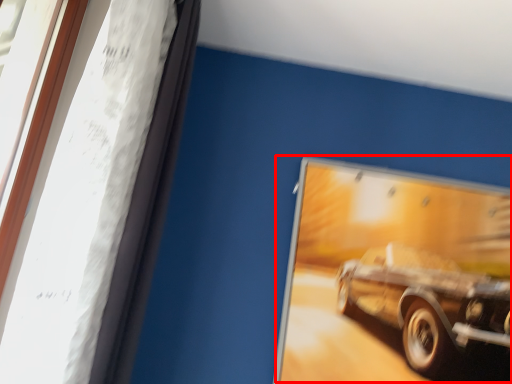
Question: In this image, where is car (annotated by the red box) located relative to window frame?

Choices:
 (A) left
 (B) right

Answer: (B)